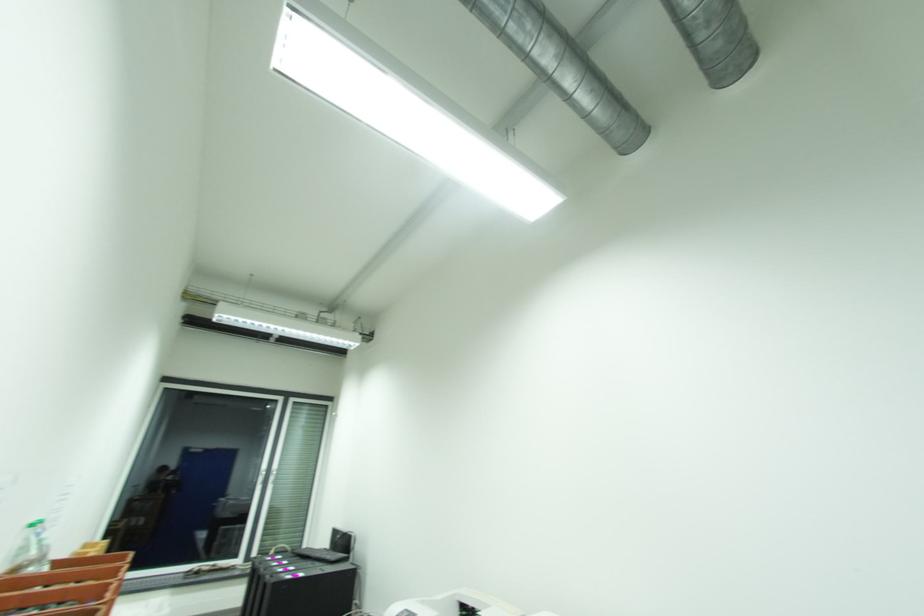
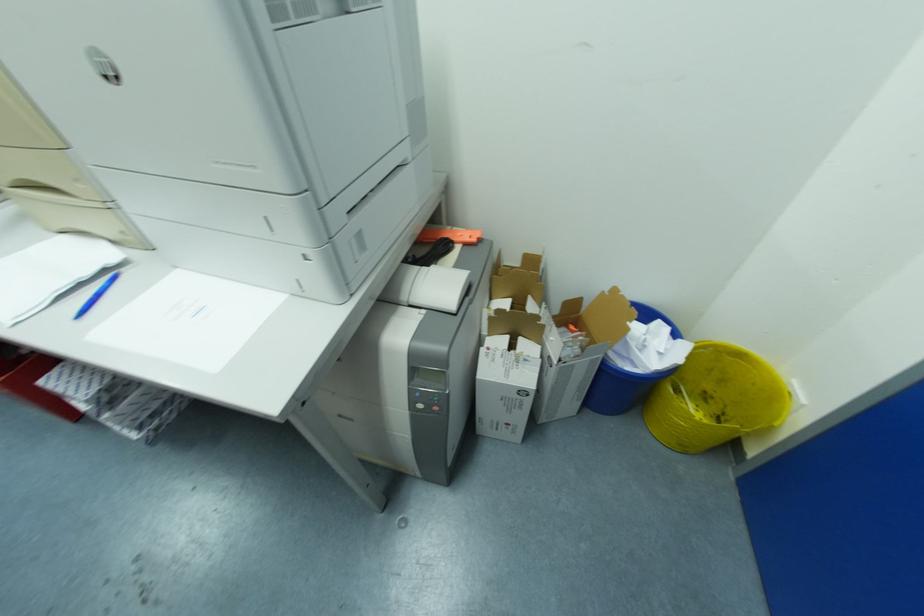
How did the camera likely rotate?

The camera rotated toward right-down.